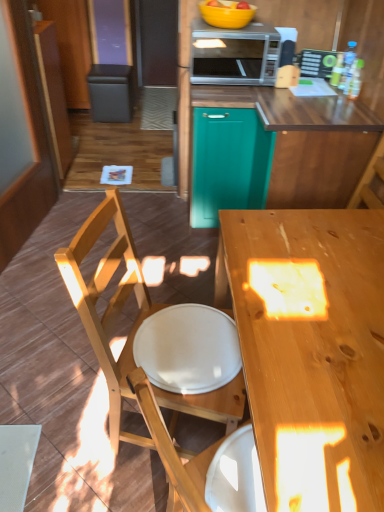
Question: Choose the correct answer: Is silver metallic microwave at upper center inside green plastic sign at upper right or outside it?

Choices:
 (A) outside
 (B) inside

Answer: (A)

Question: From their relative heights in the image, would you say silver metallic microwave at upper center is taller or shorter than green plastic sign at upper right?

Choices:
 (A) short
 (B) tall

Answer: (B)

Question: Estimate the real-world distances between objects in this image. Which object is farther from the green plastic sign at upper right?

Choices:
 (A) silver metallic microwave at upper center
 (B) white matte plate at center
 (C) yellow matte bowl at upper center
 (D) wooden countertop at center
 (E) black leather trash bin/can at upper left

Answer: (E)

Question: Which object is positioned closest to the green plastic sign at upper right?

Choices:
 (A) silver metallic microwave at upper center
 (B) white matte plate at center
 (C) wooden desk at center
 (D) wooden countertop at center
 (E) teal matte cabinet at center

Answer: (A)